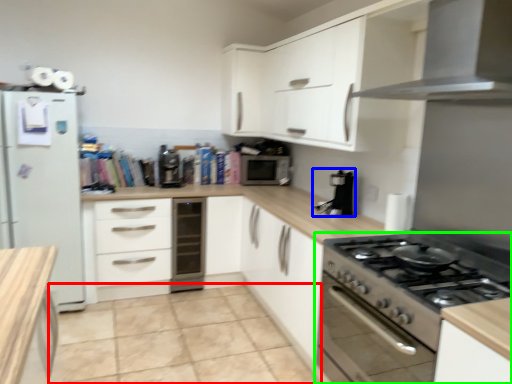
Question: Considering the real-world distances, which object is closest to tile (highlighted by a red box)? coffee machine (highlighted by a blue box) or kitchen appliance (highlighted by a green box).

Choices:
 (A) coffee machine
 (B) kitchen appliance

Answer: (B)